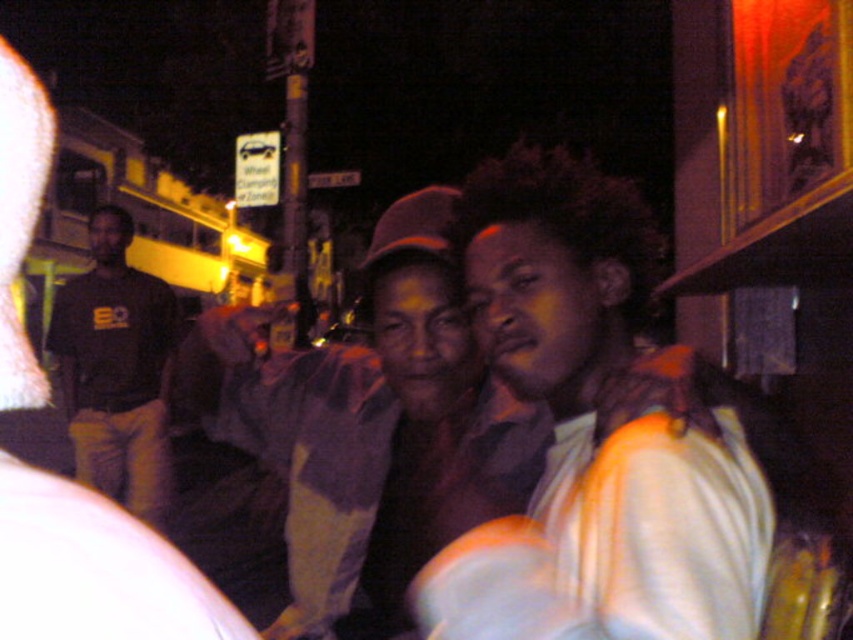
Is matte black shirt at center taller than black cotton shirt at left?

No.

Is point (48, 477) farther from camera compared to point (119, 410)?

No, it is not.

The height and width of the screenshot is (640, 853). In order to click on matte black shirt at center in this screenshot , I will do `click(96, 570)`.

Does matte purple shirt at center have a greater height compared to matte black shirt at center?

Yes.

Does matte purple shirt at center appear on the left side of matte black shirt at center?

No, matte purple shirt at center is not to the left of matte black shirt at center.

Who is more distant from viewer, (392, 557) or (1, 333)?

Point (392, 557)

Where is `matte purple shirt at center`? This screenshot has height=640, width=853. matte purple shirt at center is located at coordinates pos(368,420).

Based on the photo, is light blue shirt at center wider than matte purple shirt at center?

In fact, light blue shirt at center might be narrower than matte purple shirt at center.

Consider the image. Who is lower down, light blue shirt at center or matte purple shirt at center?

Positioned lower is matte purple shirt at center.

Who is more distant from viewer, (x=498, y=570) or (x=198, y=323)?

The point (x=198, y=323) is behind.

Locate an element on the screen. The image size is (853, 640). light blue shirt at center is located at coordinates [595, 435].